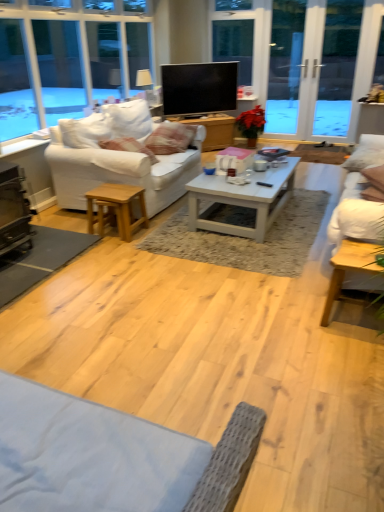
Question: Should I look upward or downward to see white painted wood coffee table at center, marked as the first table in a top-to-bottom arrangement?

Choices:
 (A) up
 (B) down

Answer: (A)

Question: Is flat screen tv at center thinner than transparent glass screen door at upper right, the 1th screen door from the left?

Choices:
 (A) yes
 (B) no

Answer: (B)

Question: Is flat screen tv at center wider than transparent glass screen door at upper right, the 1th screen door from the left?

Choices:
 (A) yes
 (B) no

Answer: (A)

Question: Is transparent glass screen door at upper right, acting as the second screen door starting from the right, at the back of flat screen tv at center?

Choices:
 (A) no
 (B) yes

Answer: (A)

Question: Is flat screen tv at center surrounding transparent glass screen door at upper right, the 1th screen door from the left?

Choices:
 (A) no
 (B) yes

Answer: (A)

Question: Is flat screen tv at center completely or partially outside of transparent glass screen door at upper right, acting as the second screen door starting from the right?

Choices:
 (A) no
 (B) yes

Answer: (B)

Question: Does flat screen tv at center have a greater height compared to transparent glass screen door at upper right, the 1th screen door from the left?

Choices:
 (A) no
 (B) yes

Answer: (A)

Question: Considering the relative positions of white painted wood coffee table at center, acting as the 2th coffee table starting from the bottom, and white painted wood coffee table at center, which ranks as the first table in back-to-front order, in the image provided, is white painted wood coffee table at center, acting as the 2th coffee table starting from the bottom, to the left of white painted wood coffee table at center, which ranks as the first table in back-to-front order, from the viewer's perspective?

Choices:
 (A) no
 (B) yes

Answer: (A)

Question: Is white painted wood coffee table at center, acting as the 2th coffee table starting from the bottom, next to white painted wood coffee table at center, marked as the first table in a top-to-bottom arrangement?

Choices:
 (A) no
 (B) yes

Answer: (A)

Question: Is white painted wood coffee table at center, which is the first coffee table from top to bottom, looking in the opposite direction of white painted wood coffee table at center, which is the second table in left-to-right order?

Choices:
 (A) yes
 (B) no

Answer: (B)

Question: Considering the relative sizes of white painted wood coffee table at center, the second coffee table from the front, and white painted wood coffee table at center, which ranks as the first table in back-to-front order, in the image provided, is white painted wood coffee table at center, the second coffee table from the front, bigger than white painted wood coffee table at center, which ranks as the first table in back-to-front order,?

Choices:
 (A) yes
 (B) no

Answer: (A)

Question: Is white painted wood coffee table at center, which is the first coffee table from top to bottom, oriented towards white painted wood coffee table at center, which is the second table in left-to-right order?

Choices:
 (A) yes
 (B) no

Answer: (B)

Question: From a real-world perspective, is white painted wood coffee table at center, the second coffee table from the front, over white painted wood coffee table at center, which ranks as the first table in back-to-front order?

Choices:
 (A) yes
 (B) no

Answer: (A)

Question: From a real-world perspective, is flat screen tv at center on green matte poinsettia at center?

Choices:
 (A) no
 (B) yes

Answer: (B)